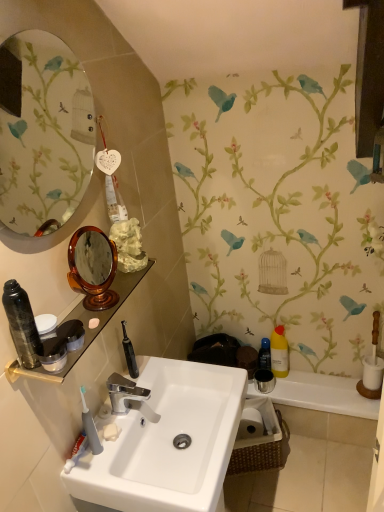
Locate an element on the screen. The width and height of the screenshot is (384, 512). empty space that is ontop of metallic silver cup at right (from a real-world perspective) is located at coordinates tap(324, 385).